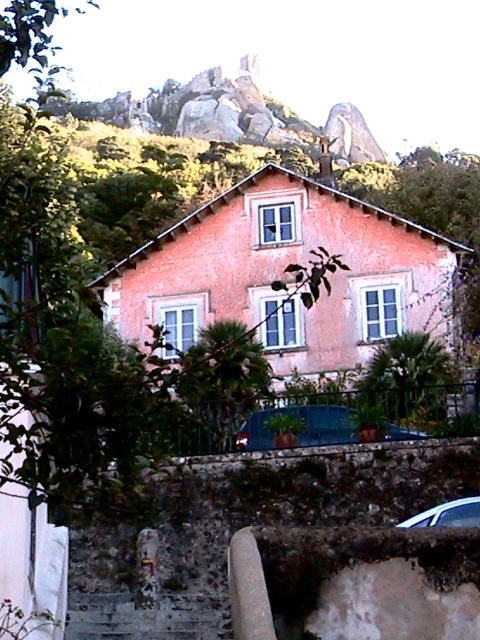
Question: Can you confirm if metallic blue car at lower center is positioned to the right of satin silver car at lower right?

Choices:
 (A) no
 (B) yes

Answer: (A)

Question: Which object is closer to the camera taking this photo?

Choices:
 (A) metallic blue car at lower center
 (B) satin silver car at lower right

Answer: (B)

Question: Among these objects, which one is nearest to the camera?

Choices:
 (A) metallic blue car at lower center
 (B) satin silver car at lower right

Answer: (B)

Question: Can you confirm if metallic blue car at lower center is positioned above satin silver car at lower right?

Choices:
 (A) yes
 (B) no

Answer: (A)

Question: Which point is closer to the camera taking this photo?

Choices:
 (A) (x=441, y=509)
 (B) (x=260, y=433)

Answer: (A)

Question: Is metallic blue car at lower center positioned before satin silver car at lower right?

Choices:
 (A) yes
 (B) no

Answer: (B)